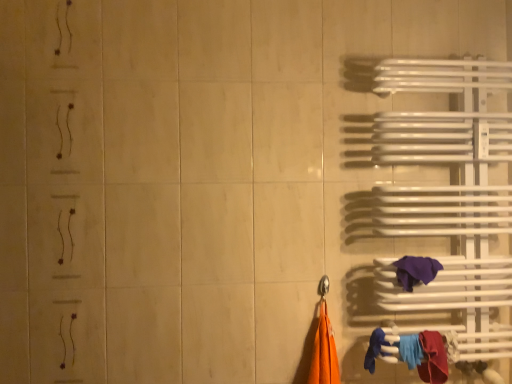
Question: Is red fabric towel at lower right, the 1th towel ordered from the bottom, wider than purple fabric towel at right, arranged as the 1th towel when viewed from the top?

Choices:
 (A) no
 (B) yes

Answer: (B)

Question: Does red fabric towel at lower right, which is the 2th towel in top-to-bottom order, have a lesser width compared to purple fabric towel at right, acting as the second towel starting from the bottom?

Choices:
 (A) no
 (B) yes

Answer: (A)

Question: Does red fabric towel at lower right, which is the 2th towel in top-to-bottom order, have a smaller size compared to purple fabric towel at right, acting as the second towel starting from the bottom?

Choices:
 (A) yes
 (B) no

Answer: (B)

Question: Is red fabric towel at lower right, which is the 2th towel in top-to-bottom order, completely or partially outside of purple fabric towel at right, acting as the second towel starting from the bottom?

Choices:
 (A) no
 (B) yes

Answer: (B)

Question: From a real-world perspective, is red fabric towel at lower right, the 1th towel ordered from the bottom, below purple fabric towel at right, arranged as the 1th towel when viewed from the top?

Choices:
 (A) yes
 (B) no

Answer: (A)

Question: From the image's perspective, is red fabric towel at lower right, which is the 2th towel in top-to-bottom order, under purple fabric towel at right, arranged as the 1th towel when viewed from the top?

Choices:
 (A) yes
 (B) no

Answer: (A)

Question: Considering the relative positions of purple fabric towel at right, arranged as the 1th towel when viewed from the top, and red fabric towel at lower right, the 1th towel ordered from the bottom, in the image provided, is purple fabric towel at right, arranged as the 1th towel when viewed from the top, behind red fabric towel at lower right, the 1th towel ordered from the bottom,?

Choices:
 (A) no
 (B) yes

Answer: (B)

Question: Is red fabric towel at lower right, the 1th towel ordered from the bottom, inside purple fabric towel at right, acting as the second towel starting from the bottom?

Choices:
 (A) no
 (B) yes

Answer: (A)

Question: Can you confirm if purple fabric towel at right, acting as the second towel starting from the bottom, is positioned to the left of red fabric towel at lower right, which is the 2th towel in top-to-bottom order?

Choices:
 (A) yes
 (B) no

Answer: (A)

Question: Can you confirm if purple fabric towel at right, arranged as the 1th towel when viewed from the top, is thinner than red fabric towel at lower right, the 1th towel ordered from the bottom?

Choices:
 (A) yes
 (B) no

Answer: (A)

Question: Can you confirm if purple fabric towel at right, acting as the second towel starting from the bottom, is shorter than red fabric towel at lower right, which is the 2th towel in top-to-bottom order?

Choices:
 (A) no
 (B) yes

Answer: (B)

Question: Is purple fabric towel at right, acting as the second towel starting from the bottom, to the right of red fabric towel at lower right, the 1th towel ordered from the bottom, from the viewer's perspective?

Choices:
 (A) yes
 (B) no

Answer: (B)

Question: From a real-world perspective, relative to red fabric towel at lower right, which is the 2th towel in top-to-bottom order, is purple fabric towel at right, acting as the second towel starting from the bottom, vertically above or below?

Choices:
 (A) below
 (B) above

Answer: (B)